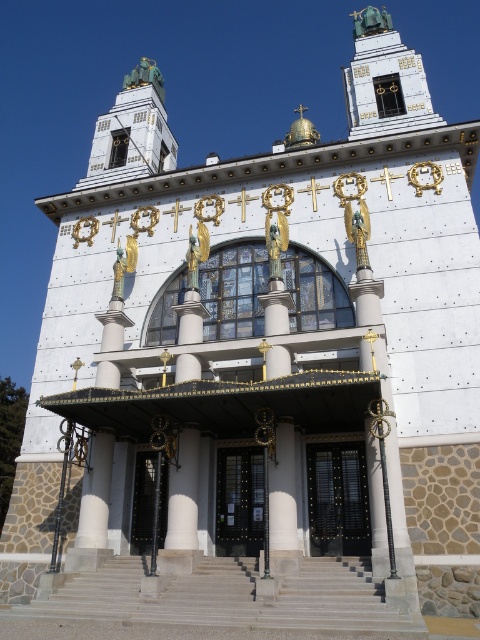
You are a visitor approaching the modernist church and want to enter through the entrance. You see the gray concrete stairs at center and the black metal gate at center. Which object should you approach first to reach the entrance?

The gray concrete stairs at center is to the left of the black metal gate at center. Since the stairs are positioned to the left of the gate, you should approach the gray concrete stairs at center first to reach the entrance.

You are a visitor approaching the modernist church and notice the gray concrete stairs at center and the white stone pillar at center. Which of these two objects is wider?

The gray concrete stairs at center might be wider than the white stone pillar at center according to the description.

You are a visitor arriving at the modernist church and need to enter through the entrance. You see the gray concrete stairs at center and the black metal gate at center. Which one is bigger in size?

The gray concrete stairs at center is larger in size than the black metal gate at center, so the stairs are bigger.